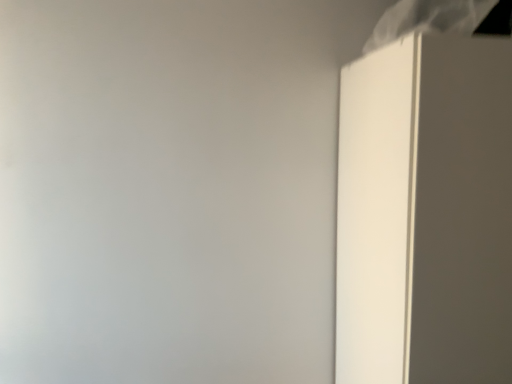
Where is `white matte cupboard at right`? white matte cupboard at right is located at coordinates (425, 214).

What do you see at coordinates (425, 214) in the screenshot? The width and height of the screenshot is (512, 384). I see `white matte cupboard at right` at bounding box center [425, 214].

Find the location of a particular element. The image size is (512, 384). white matte cupboard at right is located at coordinates 425,214.